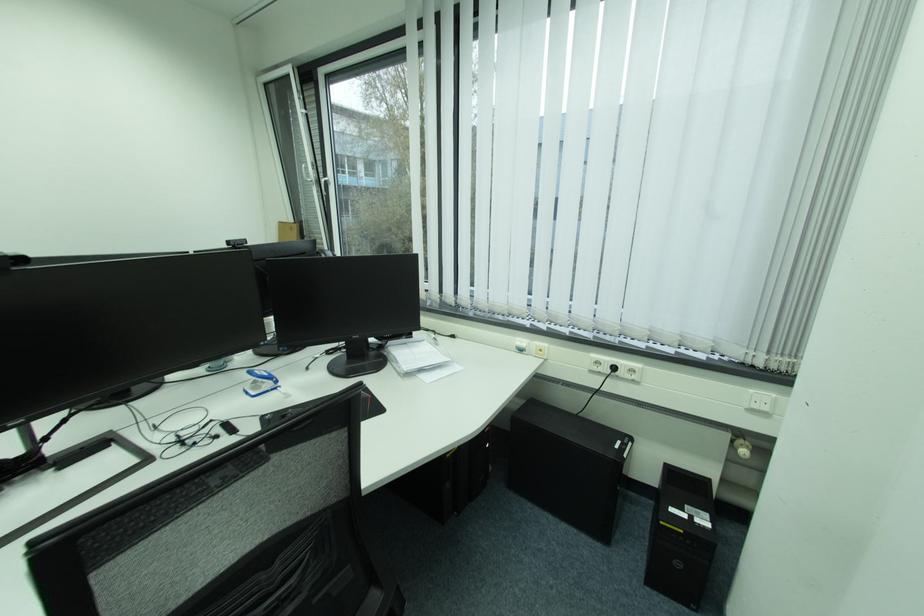
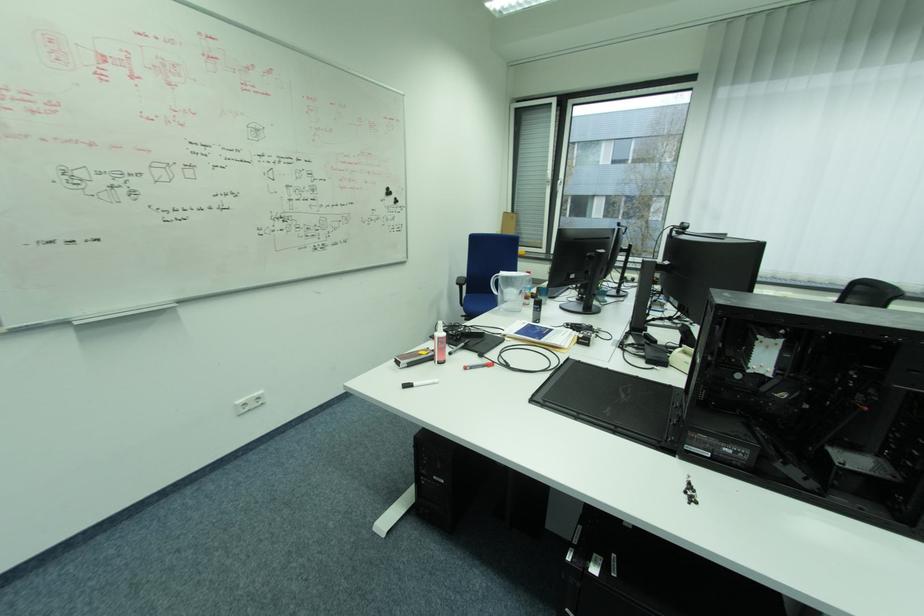
Question: I am providing you with two images of the same scene from different viewpoints. After the viewpoint changes to image2, which objects are now occluded?

Choices:
 (A) white tube bottle
 (B) black brake lever
 (C) black round magnet
 (D) black webcam

Answer: (D)